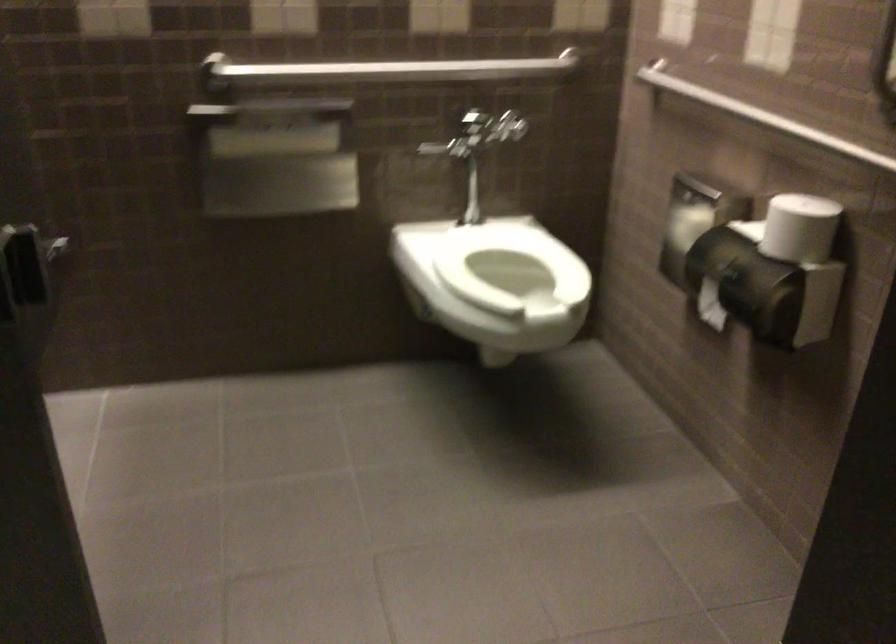
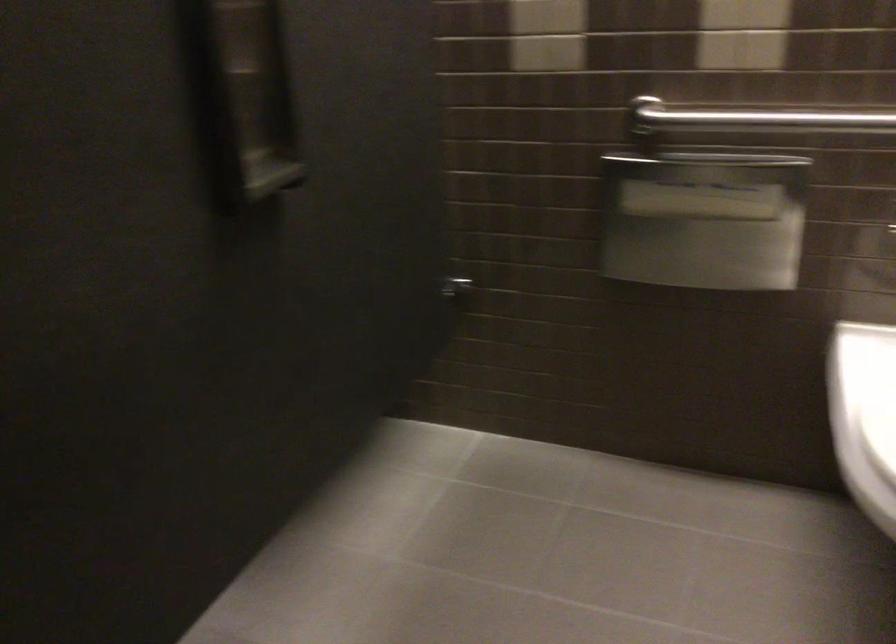
Locate, in the second image, the point that corresponds to (309,69) in the first image.

(751, 116)